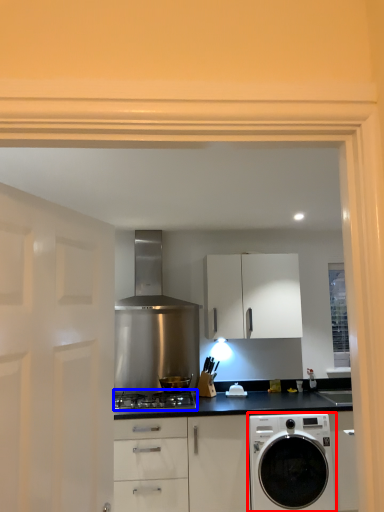
Question: Which object is further to the camera taking this photo, washing machine (highlighted by a red box) or gas stove (highlighted by a blue box)?

Choices:
 (A) washing machine
 (B) gas stove

Answer: (B)